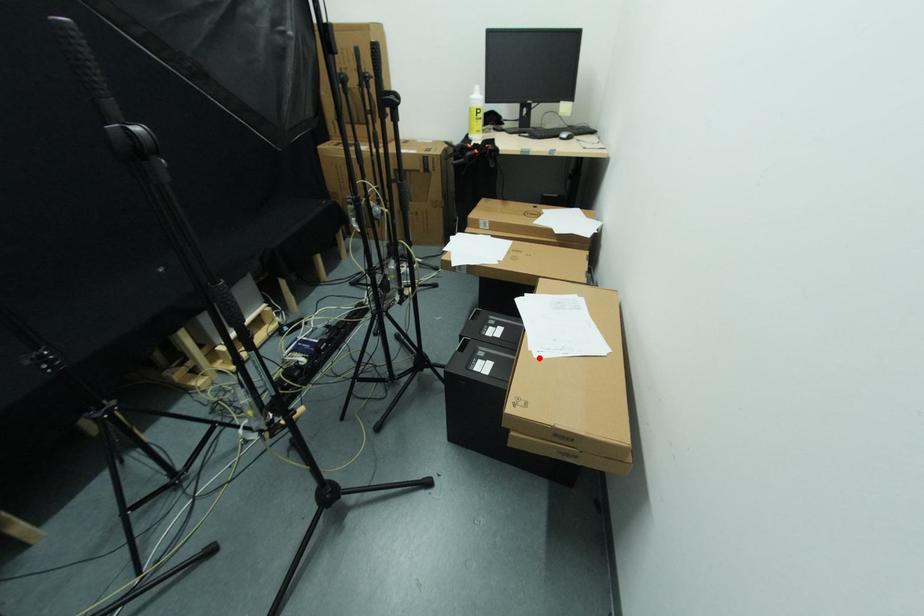
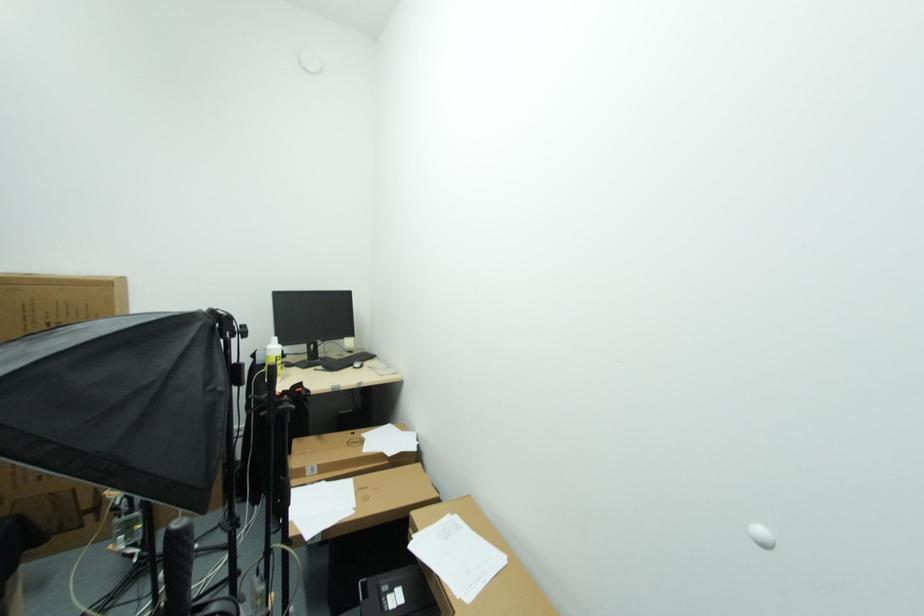
Question: I am providing you with two images of the same scene from different viewpoints. A red point is marked on the first image. Can you still see the location of the red point in image 2?

Choices:
 (A) Yes
 (B) No

Answer: (A)